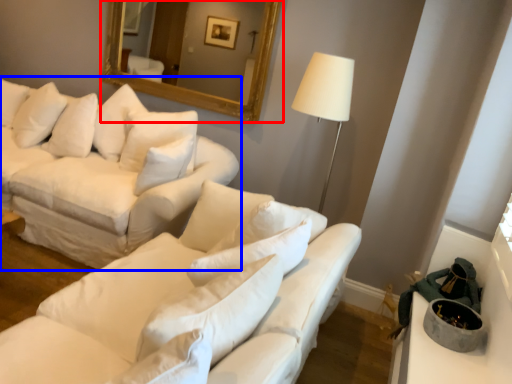
Question: Which point is further to the camera, mirror (highlighted by a red box) or studio couch (highlighted by a blue box)?

Choices:
 (A) mirror
 (B) studio couch

Answer: (A)